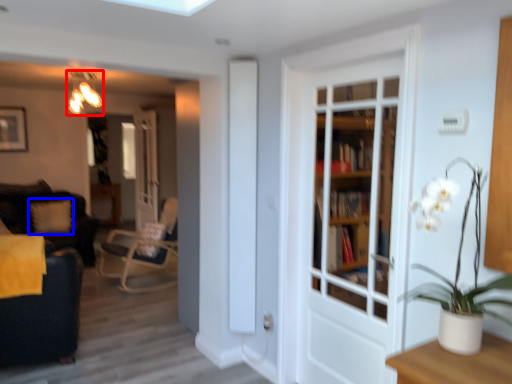
Question: Which object is closer to the camera taking this photo, light fixture (highlighted by a red box) or pillow (highlighted by a blue box)?

Choices:
 (A) light fixture
 (B) pillow

Answer: (A)